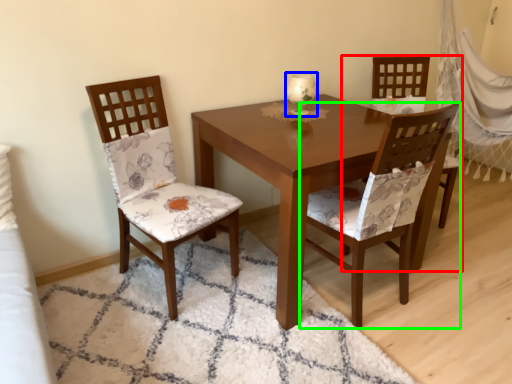
Question: Considering the real-world distances, which object is farthest from chair (highlighted by a red box)? candle holder (highlighted by a blue box) or chair (highlighted by a green box)?

Choices:
 (A) candle holder
 (B) chair

Answer: (A)